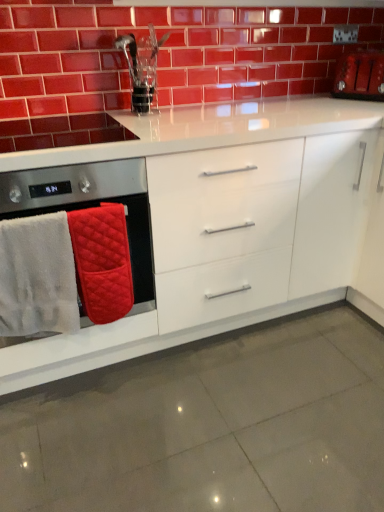
At what (x,y) coordinates should I click in order to perform the action: click on free space in front of matte red toaster at upper right. Please return your answer as a coordinate pair (x, y). The image size is (384, 512). Looking at the image, I should click on (355, 106).